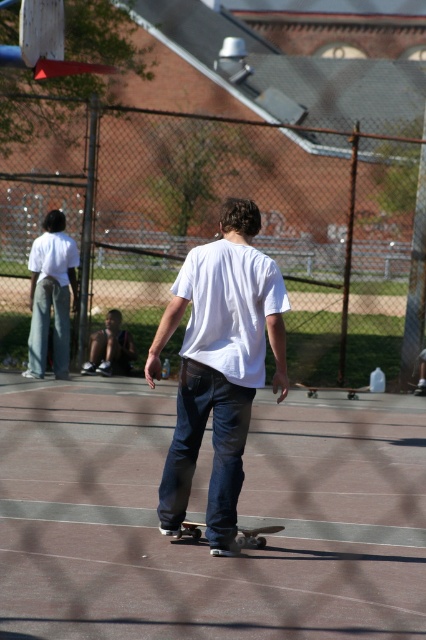
You are standing at the camera position and want to call out to the white cotton shirt at left. Considering the distance, is it possible to shout loudly enough for them to hear you?

The white cotton shirt at left is 15.27 meters away from the camera. Shouting at this distance may be possible, but it depends on environmental factors like wind and background noise. In ideal conditions, it could be heard, but there is no guarantee.

You are standing at point (218, 228) in the basketball court scene. What object is located exactly at your current position?

The metallic chain link fence at center is located exactly at point (218, 228).